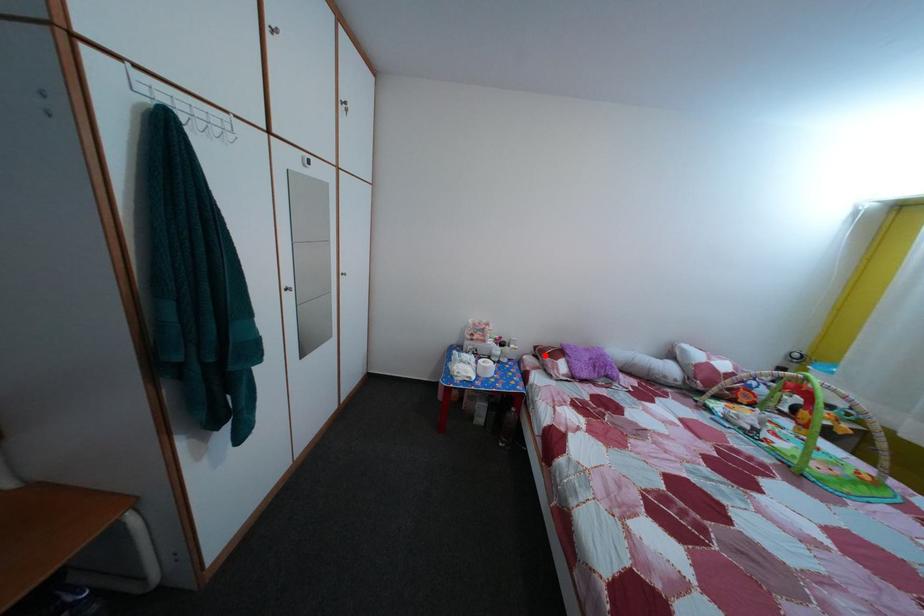
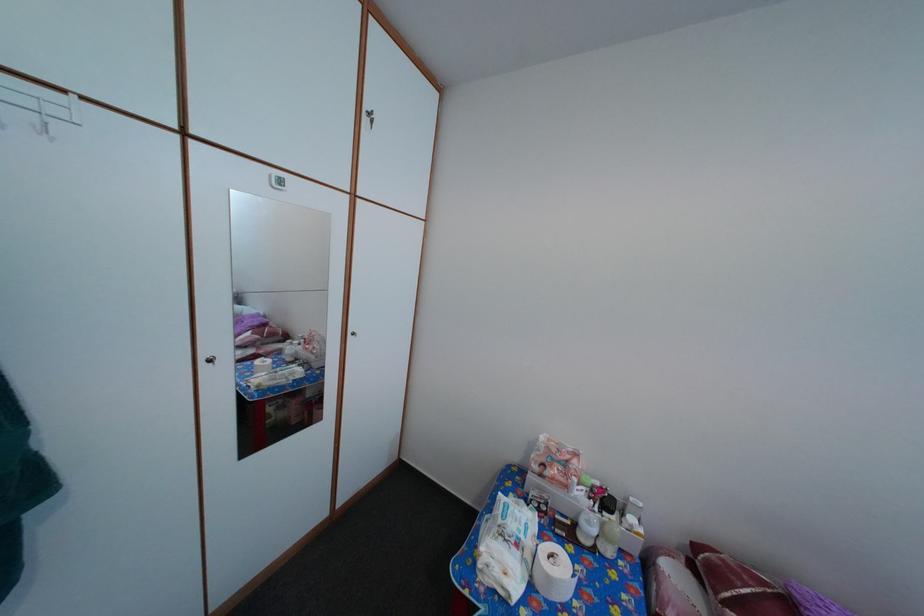
In the second image, find the point that corresponds to the highlighted location in the first image.

(704, 554)